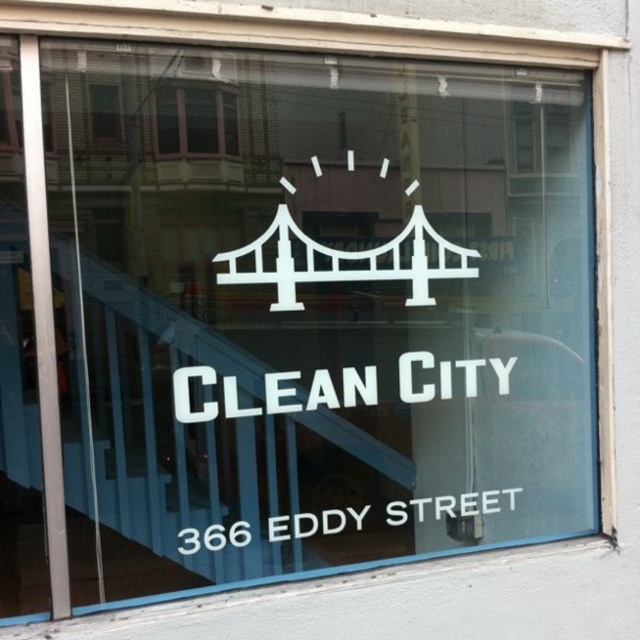
Question: Is white vinyl sign at lower center wider than clear glass window at upper center?

Choices:
 (A) no
 (B) yes

Answer: (B)

Question: Based on their relative distances, which object is nearer to the white vinyl sign at lower center?

Choices:
 (A) clear glass window at upper center
 (B) transparent glass window at upper left

Answer: (A)

Question: Estimate the real-world distances between objects in this image. Which object is closer to the white matte bridge at center?

Choices:
 (A) white vinyl sign at lower center
 (B) white matte sign at center
 (C) clear glass window at upper center
 (D) transparent glass window at upper left

Answer: (B)

Question: Is white matte sign at center to the right of transparent glass window at upper left from the viewer's perspective?

Choices:
 (A) no
 (B) yes

Answer: (B)

Question: From the image, what is the correct spatial relationship of white matte bridge at center in relation to transparent glass window at upper left?

Choices:
 (A) below
 (B) above

Answer: (A)

Question: Which object is closer to the camera taking this photo?

Choices:
 (A) clear glass window at upper center
 (B) white matte sign at center

Answer: (A)